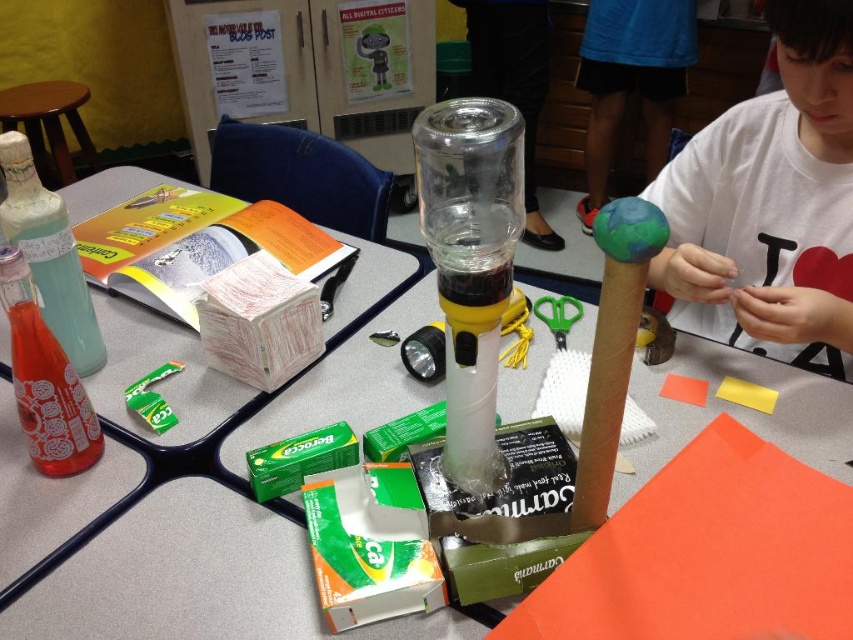
Question: Can you confirm if translucent glass bottle at left is positioned to the right of matte glass bottle at left?

Choices:
 (A) no
 (B) yes

Answer: (B)

Question: Is the position of translucent plastic bottle at center less distant than that of matte glass bottle at left?

Choices:
 (A) yes
 (B) no

Answer: (A)

Question: Considering the real-world distances, which object is farthest from the matte glass bottle at left?

Choices:
 (A) green plastic tape at center
 (B) translucent glass bottle at left
 (C) wooden stool at upper left
 (D) translucent plastic bottle at center

Answer: (C)

Question: Which of the following is the farthest from the observer?

Choices:
 (A) translucent plastic bottle at center
 (B) matte glass bottle at left
 (C) white cotton shirt at upper right
 (D) wooden stool at upper left

Answer: (D)

Question: Is wooden stool at upper left below green plastic tape at center?

Choices:
 (A) yes
 (B) no

Answer: (B)

Question: Based on their relative distances, which object is farther from the translucent plastic bottle at center?

Choices:
 (A) wooden stool at upper left
 (B) matte glass bottle at left

Answer: (A)